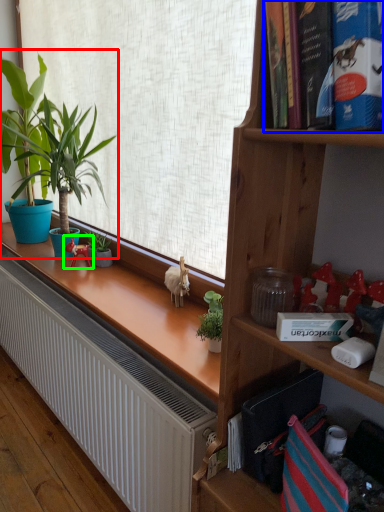
Question: Which is nearer to the houseplant (highlighted by a red box)? book (highlighted by a blue box) or toy (highlighted by a green box).

Choices:
 (A) book
 (B) toy

Answer: (B)